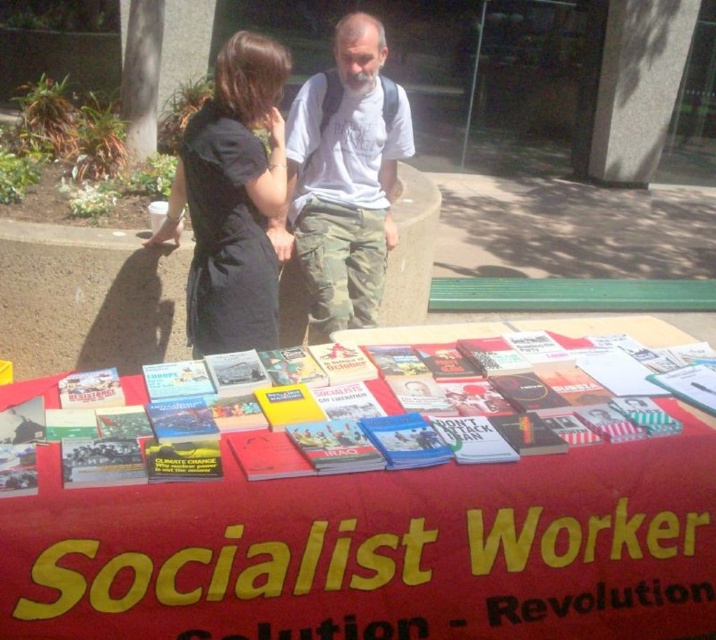
Question: Which point appears farthest from the camera in this image?

Choices:
 (A) (263, 65)
 (B) (296, 214)

Answer: (B)

Question: Does white cotton t-shirt at center have a larger size compared to black fabric shirt at upper left?

Choices:
 (A) yes
 (B) no

Answer: (A)

Question: Which object is positioned farthest from the red paper table at center?

Choices:
 (A) white cotton t-shirt at center
 (B) black fabric shirt at upper left

Answer: (A)

Question: Does red paper table at center come in front of white cotton t-shirt at center?

Choices:
 (A) yes
 (B) no

Answer: (A)

Question: Which of the following is the closest to the observer?

Choices:
 (A) (309, 122)
 (B) (39, 508)

Answer: (B)

Question: Can you confirm if red paper table at center is positioned to the left of black fabric shirt at upper left?

Choices:
 (A) yes
 (B) no

Answer: (B)